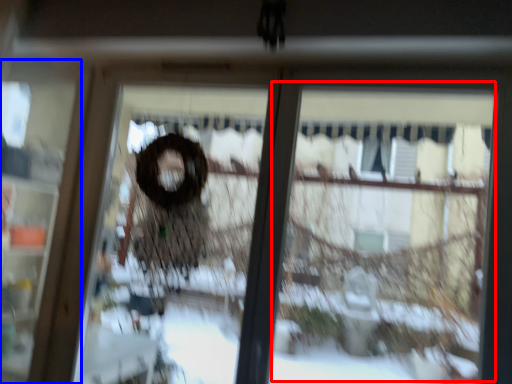
Question: Which of the following is the closest to the observer, shop window (highlighted by a red box) or screen door (highlighted by a blue box)?

Choices:
 (A) shop window
 (B) screen door

Answer: (A)